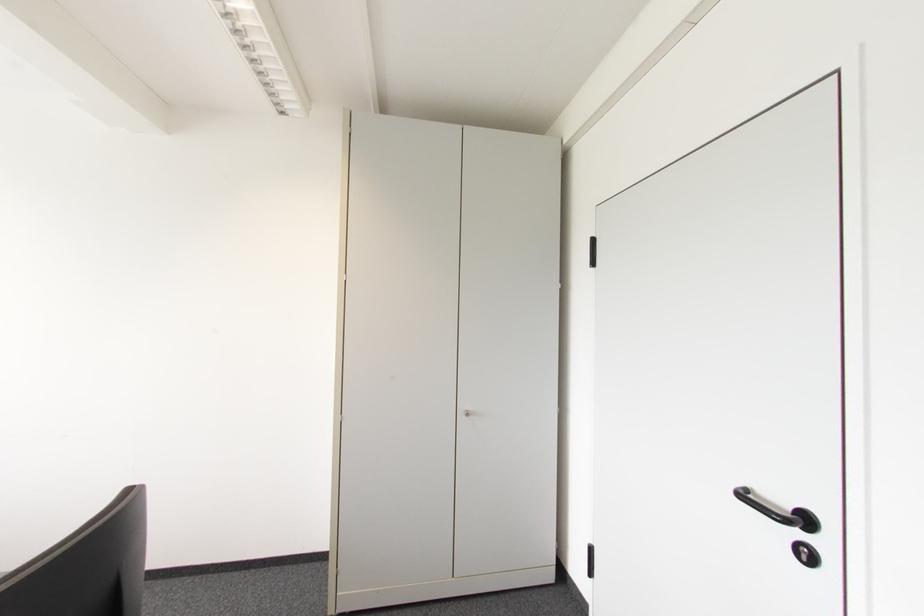
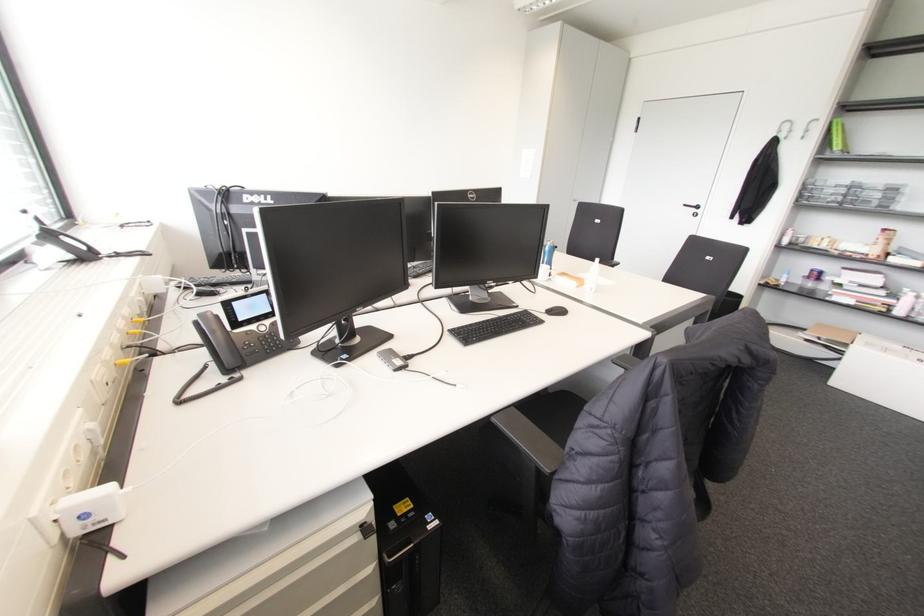
Where in the second image is the point corresponding to (x=805, y=521) from the first image?

(697, 207)